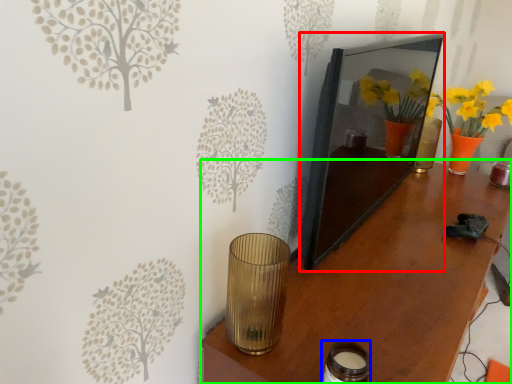
Question: Based on their relative distances, which object is farther from picture frame (highlighted by a red box)? Choose from candle holder (highlighted by a blue box) and table (highlighted by a green box).

Choices:
 (A) candle holder
 (B) table

Answer: (A)